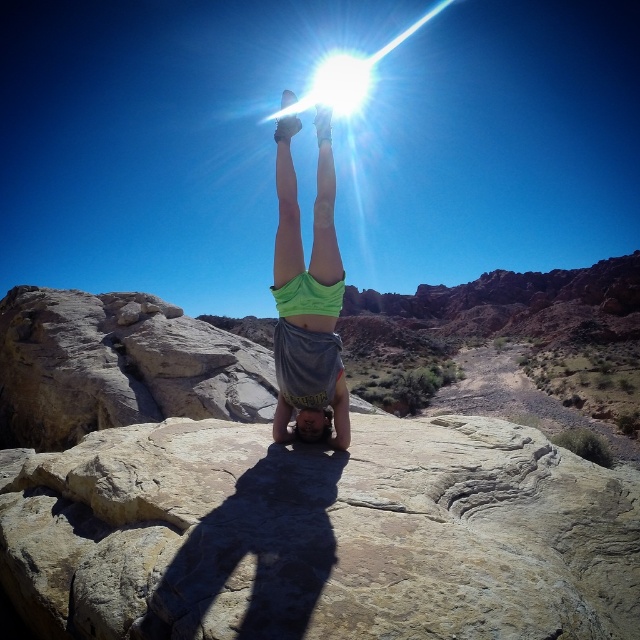
Question: Can you confirm if smooth beige rock at center is bigger than green fabric at center?

Choices:
 (A) yes
 (B) no

Answer: (B)

Question: Is smooth beige rock at center thinner than green fabric at center?

Choices:
 (A) yes
 (B) no

Answer: (B)

Question: Is smooth beige rock at center bigger than green fabric at center?

Choices:
 (A) no
 (B) yes

Answer: (A)